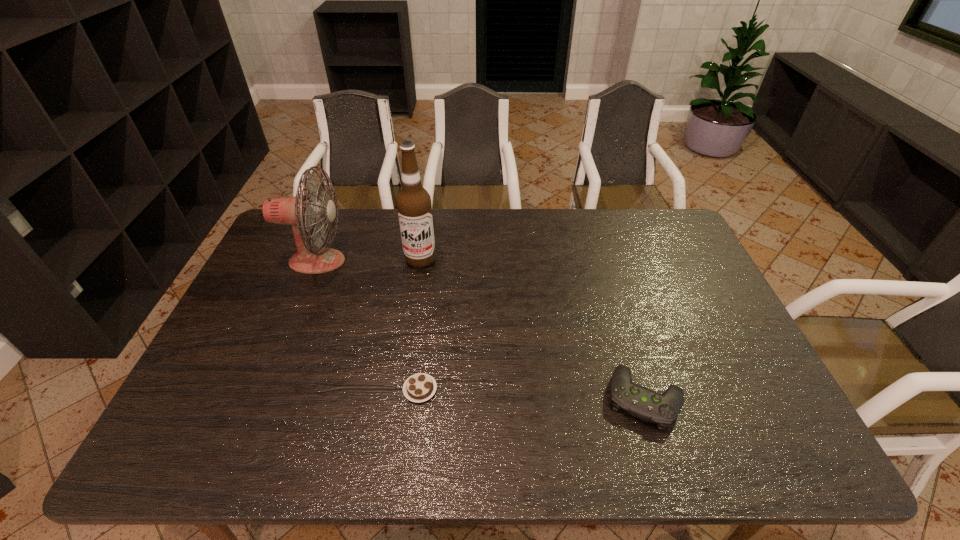
Find the location of a particular element. The width and height of the screenshot is (960, 540). alcohol is located at coordinates (413, 202).

Where is `fan`? The image size is (960, 540). fan is located at coordinates (299, 211).

In order to click on the second tallest object in this screenshot , I will do `click(299, 211)`.

Locate an element on the screen. Image resolution: width=960 pixels, height=540 pixels. control is located at coordinates (662, 409).

Where is `the rightmost object`? The height and width of the screenshot is (540, 960). the rightmost object is located at coordinates pyautogui.click(x=662, y=409).

I want to click on the shortest object, so click(420, 387).

Locate an element on the screen. Image resolution: width=960 pixels, height=540 pixels. vacant area situated 0.290m on the label of the tallest object is located at coordinates (408, 341).

The image size is (960, 540). I want to click on vacant region located 0.080m in front of the third shortest object to direct airflow, so click(372, 261).

At what (x,y) coordinates should I click in order to perform the action: click on free space located 0.280m on the left of the control. Please return your answer as a coordinate pair (x, y). The width and height of the screenshot is (960, 540). Looking at the image, I should click on (492, 398).

Find the location of a particular element. The width and height of the screenshot is (960, 540). vacant space positioned 0.200m on the right of the shortest object is located at coordinates [x=517, y=389].